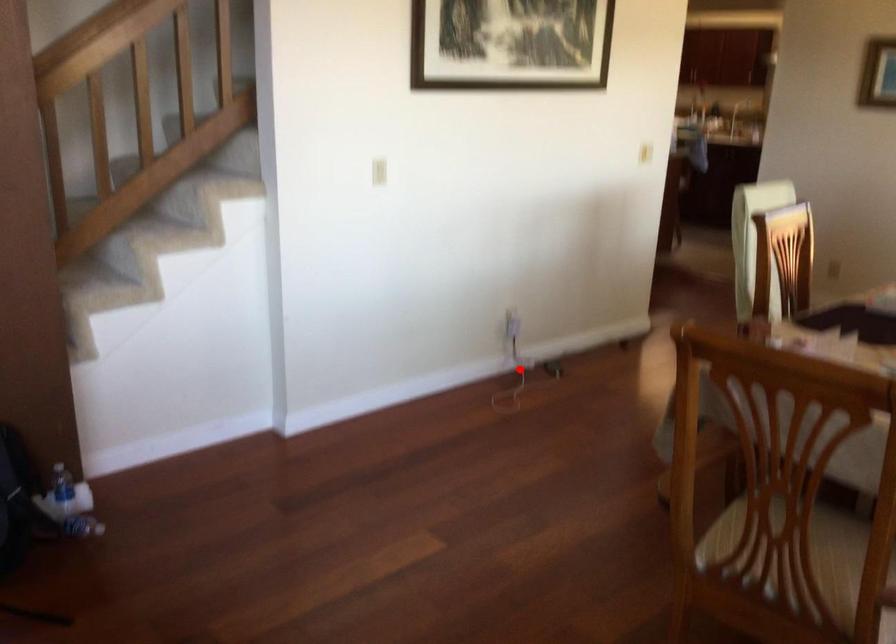
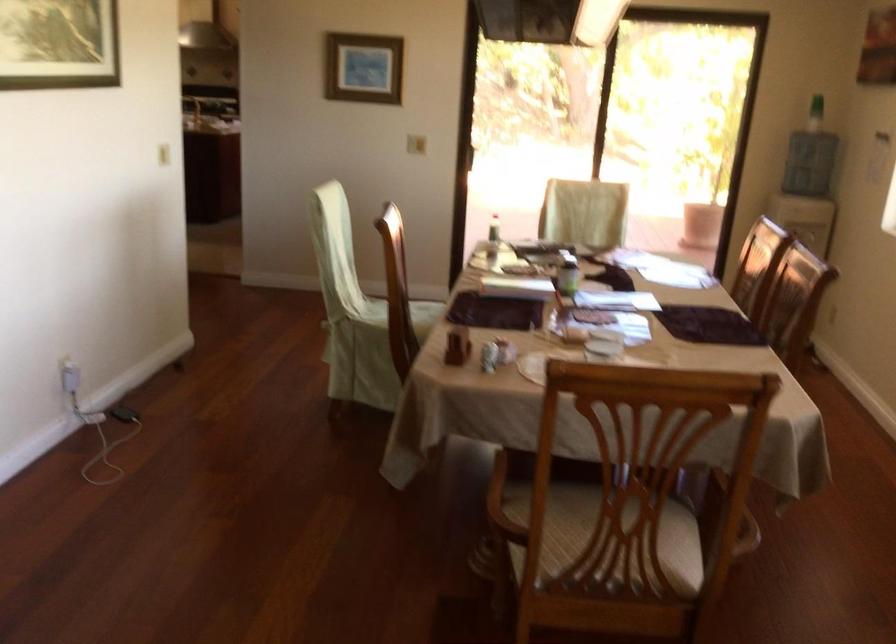
Question: I am providing you with two images of the same scene from different viewpoints. In image1, a red point is highlighted. Considering the same 3D point in image2, which of the following is correct?

Choices:
 (A) It is closer
 (B) It is farther

Answer: (A)